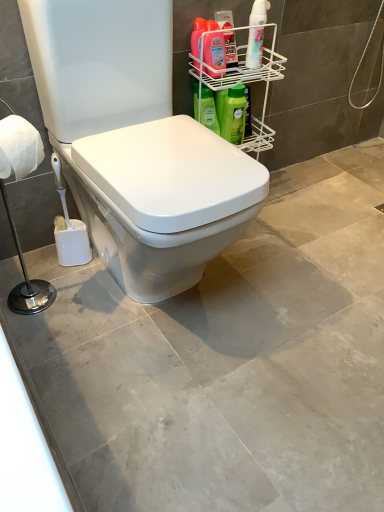
Question: From a real-world perspective, is white matte toilet paper at left above or below white wire rack at upper right?

Choices:
 (A) above
 (B) below

Answer: (A)

Question: Is white matte toilet paper at left inside or outside of white wire rack at upper right?

Choices:
 (A) inside
 (B) outside

Answer: (B)

Question: Which of these objects is positioned closest to the white glossy spray bottle at upper right, the first cleaning product positioned from the right?

Choices:
 (A) white glossy toilet at center
 (B) white wire rack at upper right
 (C) white matte toilet paper at left
 (D) green matte bottle at upper right, the 5th cleaning product when ordered from right to left
 (E) green matte bottle at upper right, the second cleaning product in the right-to-left sequence

Answer: (B)

Question: Which object is the farthest from the green matte bottle at upper right, the 5th cleaning product when ordered from right to left?

Choices:
 (A) green matte bottle at upper right, the second cleaning product in the right-to-left sequence
 (B) white matte toilet paper at left
 (C) matte pink bottle at upper right, positioned as the 2th cleaning product in left-to-right order
 (D) white glossy spray bottle at upper right, acting as the fifth cleaning product starting from the left
 (E) white glossy toilet at center

Answer: (B)